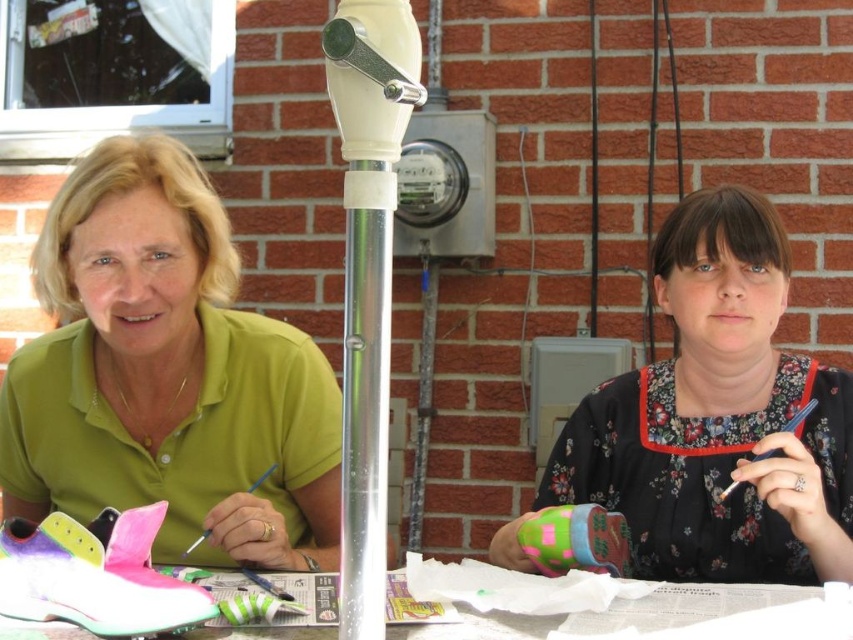
Question: Which point is closer to the camera?

Choices:
 (A) (770, 620)
 (B) (846, 509)

Answer: (A)

Question: Among these objects, which one is farthest from the camera?

Choices:
 (A) green matte shirt at center
 (B) white paper at center
 (C) floral fabric dress at center

Answer: (A)

Question: Is green matte shirt at center wider than white paper at center?

Choices:
 (A) no
 (B) yes

Answer: (A)

Question: Does floral fabric dress at center appear under white paper at center?

Choices:
 (A) yes
 (B) no

Answer: (B)

Question: Which object is the farthest from the green matte shirt at center?

Choices:
 (A) white paper at center
 (B) floral fabric dress at center

Answer: (A)

Question: Is floral fabric dress at center smaller than white paper at center?

Choices:
 (A) no
 (B) yes

Answer: (A)